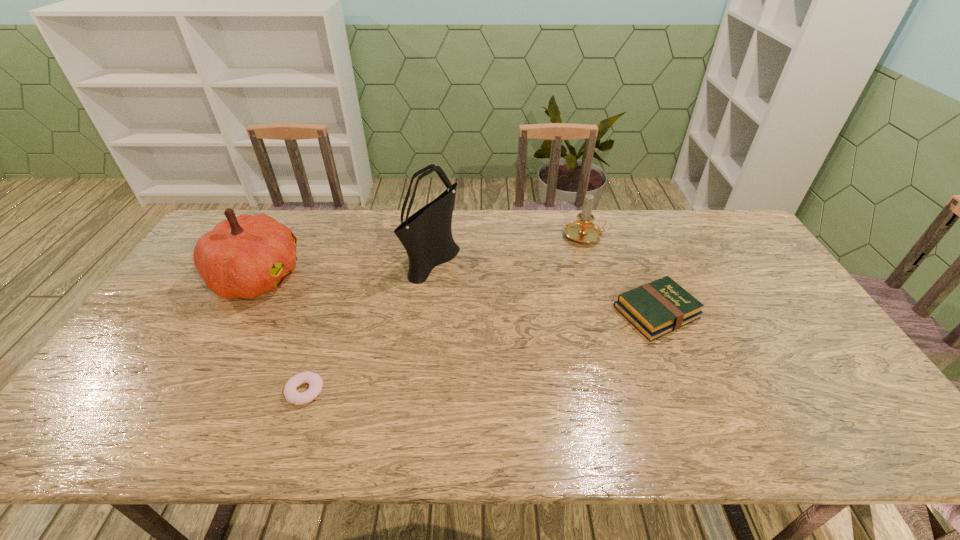
Locate an element on the screen. This screenshot has height=540, width=960. shoulder bag is located at coordinates (426, 235).

Find the location of a particular element. This screenshot has height=540, width=960. the third object from left to right is located at coordinates (426, 235).

The width and height of the screenshot is (960, 540). Find the location of `pumpkin`. pumpkin is located at coordinates (244, 256).

Identify the location of the fourth shortest object. Image resolution: width=960 pixels, height=540 pixels. (244, 256).

Where is `candle`? Image resolution: width=960 pixels, height=540 pixels. candle is located at coordinates (583, 230).

I want to click on book, so click(657, 308).

The height and width of the screenshot is (540, 960). Identify the location of the nearest object. (315, 382).

Find the location of `the second object from left to right`. the second object from left to right is located at coordinates (315, 382).

The height and width of the screenshot is (540, 960). I want to click on vacant area situated 0.340m on the left of the third object from left to right, so click(303, 259).

You are a GUI agent. You are given a task and a screenshot of the screen. Output one action in this format:
    pyautogui.click(x=<x>, y=<y>)
    Task: Click on the vacant space situated on the front-facing side of the leftmost object
    
    Given the screenshot: What is the action you would take?
    pyautogui.click(x=393, y=277)